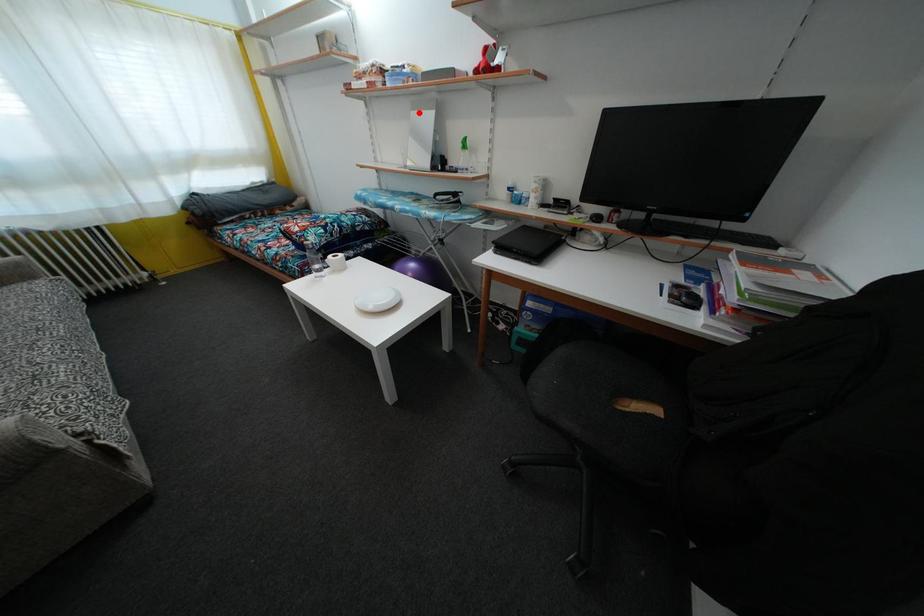
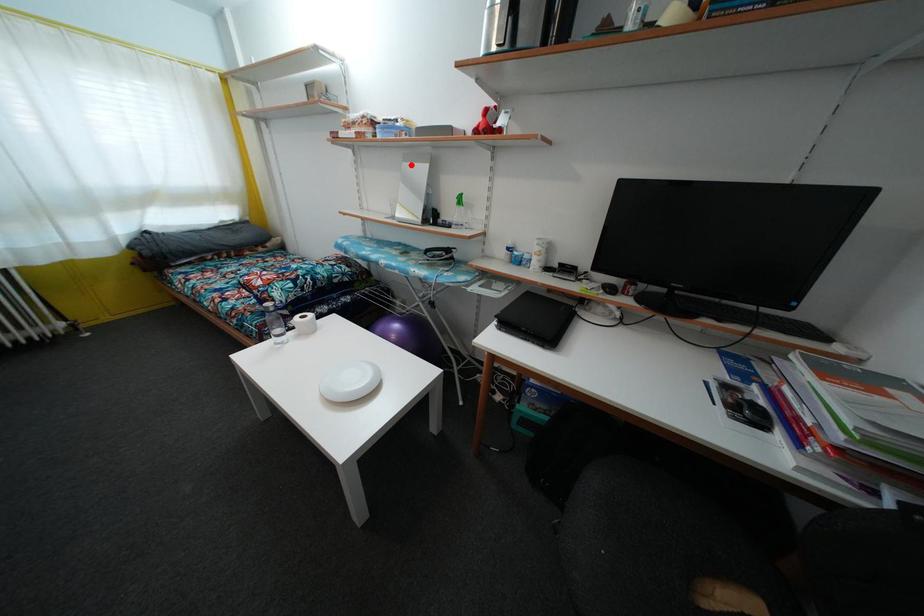
From the picture: I am providing you with two images of the same scene from different viewpoints. A red point is marked on the first image and another point is marked on the second image. Are the points marked in image1 and image2 representing the same 3D position?

Yes